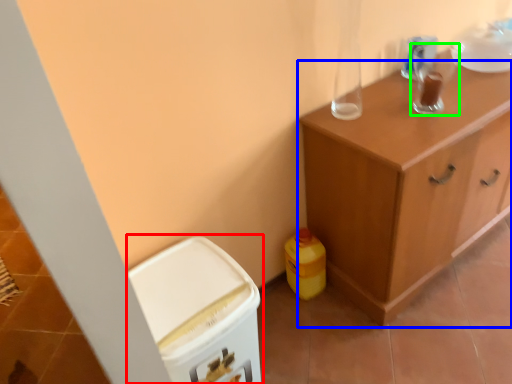
Question: Which object is positioned closest to cabinetry (highlighted by a red box)? Select from cabinetry (highlighted by a blue box) and appliance (highlighted by a green box).

Choices:
 (A) cabinetry
 (B) appliance

Answer: (A)